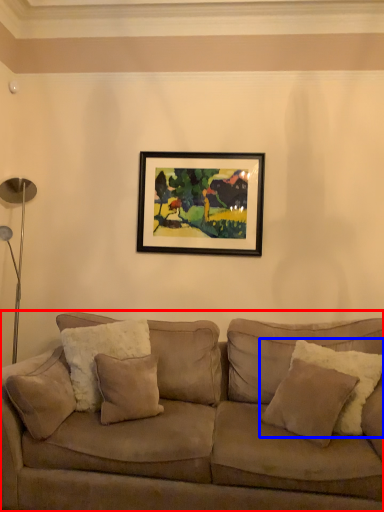
Question: Among these objects, which one is nearest to the camera, studio couch (highlighted by a red box) or pillow (highlighted by a blue box)?

Choices:
 (A) studio couch
 (B) pillow

Answer: (A)